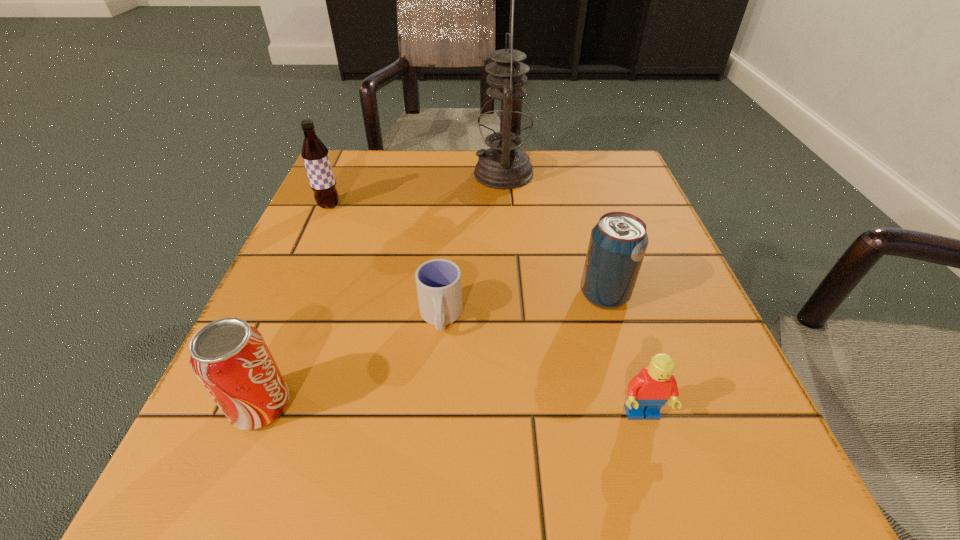
Identify the location of vacant point located between the cup and the second shortest object. Image resolution: width=960 pixels, height=540 pixels. (541, 366).

The image size is (960, 540). I want to click on free space between the third object from right to left and the root beer, so click(417, 190).

I want to click on vacant point located between the Lego and the nearer soda can, so tap(451, 410).

Identify the location of vacant point located between the second tallest object and the cup. (385, 261).

Where is `vacant area that lies between the right soda can and the fourth object from left to right`? The image size is (960, 540). vacant area that lies between the right soda can and the fourth object from left to right is located at coordinates (554, 234).

Where is `free spot between the Lego and the farthest object`? This screenshot has height=540, width=960. free spot between the Lego and the farthest object is located at coordinates point(573,294).

Image resolution: width=960 pixels, height=540 pixels. I want to click on vacant space that is in between the farther soda can and the second tallest object, so click(x=467, y=250).

Locate an element on the screen. free spot between the root beer and the tallest object is located at coordinates (417, 190).

This screenshot has height=540, width=960. I want to click on vacant space that's between the fifth nearest object and the third object from right to left, so click(x=417, y=190).

Select which object appears as the closest to the nearer soda can. Please provide its 2D coordinates. Your answer should be formatted as a tuple, i.e. [(x, y)], where the tuple contains the x and y coordinates of a point satisfying the conditions above.

[(438, 281)]